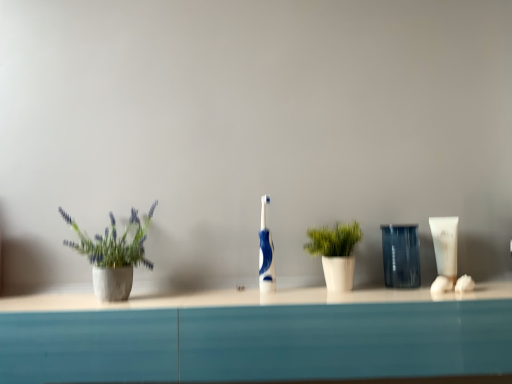
Image resolution: width=512 pixels, height=384 pixels. What are the coordinates of `white matte tube at right` in the screenshot? It's located at (445, 245).

What do you see at coordinates (401, 255) in the screenshot?
I see `transparent plastic cup at center` at bounding box center [401, 255].

How much space does matte concrete pot at left, the 2th houseplant when ordered from right to left, occupy horizontally?

It is 7.01 inches.

The height and width of the screenshot is (384, 512). I want to click on white matte tube at right, so pyautogui.click(x=445, y=245).

Which is more to the left, transparent plastic cup at center or white matte plant pot at center, the second houseplant when ordered from left to right?

Positioned to the left is white matte plant pot at center, the second houseplant when ordered from left to right.

Is transparent plastic cup at center bigger than white matte plant pot at center, which ranks as the first houseplant in right-to-left order?

No, transparent plastic cup at center is not bigger than white matte plant pot at center, which ranks as the first houseplant in right-to-left order.

Considering the sizes of objects transparent plastic cup at center and white matte plant pot at center, the second houseplant when ordered from left to right, in the image provided, who is taller, transparent plastic cup at center or white matte plant pot at center, the second houseplant when ordered from left to right,?

transparent plastic cup at center.

Which object is closer to the camera taking this photo, matte concrete pot at left, the 2th houseplant when ordered from right to left, or white matte tube at right?

Positioned in front is matte concrete pot at left, the 2th houseplant when ordered from right to left.

Is matte concrete pot at left, which is the first houseplant in left-to-right order, to the left of white matte tube at right from the viewer's perspective?

Indeed, matte concrete pot at left, which is the first houseplant in left-to-right order, is positioned on the left side of white matte tube at right.

Is point (98, 285) positioned before point (448, 226)?

That is True.

Looking at the image, does matte concrete pot at left, which is the first houseplant in left-to-right order, seem bigger or smaller compared to white matte tube at right?

matte concrete pot at left, which is the first houseplant in left-to-right order, is bigger than white matte tube at right.

Does white matte plant pot at center, the second houseplant when ordered from left to right, have a greater height compared to matte concrete pot at left, the 2th houseplant when ordered from right to left?

No.

Is point (339, 256) closer to viewer compared to point (135, 246)?

No, it is behind (135, 246).

Is white matte plant pot at center, the second houseplant when ordered from left to right, bigger than matte concrete pot at left, the 2th houseplant when ordered from right to left?

No, white matte plant pot at center, the second houseplant when ordered from left to right, is not bigger than matte concrete pot at left, the 2th houseplant when ordered from right to left.

From the picture: Can matte concrete pot at left, the 2th houseplant when ordered from right to left, be found inside white matte plant pot at center, the second houseplant when ordered from left to right?

No, matte concrete pot at left, the 2th houseplant when ordered from right to left, is not surrounded by white matte plant pot at center, the second houseplant when ordered from left to right.

Consider the image. Would you consider white matte plant pot at center, which ranks as the first houseplant in right-to-left order, to be distant from white matte tube at right?

white matte plant pot at center, which ranks as the first houseplant in right-to-left order, is near white matte tube at right, not far away.

Is white matte plant pot at center, the second houseplant when ordered from left to right, positioned in front of white matte tube at right?

Yes, white matte plant pot at center, the second houseplant when ordered from left to right, is closer to the camera.

Considering the relative sizes of white matte plant pot at center, the second houseplant when ordered from left to right, and white matte tube at right in the image provided, is white matte plant pot at center, the second houseplant when ordered from left to right, shorter than white matte tube at right?

Incorrect, the height of white matte plant pot at center, the second houseplant when ordered from left to right, does not fall short of that of white matte tube at right.

Considering the sizes of objects white matte plant pot at center, the second houseplant when ordered from left to right, and white matte tube at right in the image provided, who is thinner, white matte plant pot at center, the second houseplant when ordered from left to right, or white matte tube at right?

Thinner between the two is white matte tube at right.

Which point is more forward, [101,279] or [347,279]?

The point [101,279] is in front.

Between matte concrete pot at left, which is the first houseplant in left-to-right order, and white matte plant pot at center, the second houseplant when ordered from left to right, which one has smaller size?

With smaller size is white matte plant pot at center, the second houseplant when ordered from left to right.

Looking at this image, is matte concrete pot at left, which is the first houseplant in left-to-right order, not close to white matte plant pot at center, the second houseplant when ordered from left to right?

They are positioned close to each other.

This screenshot has width=512, height=384. Identify the location of toothbrush that appears above the white matte tube at right (from a real-world perspective). (266, 253).

Is blue glossy toothbrush at center shorter than white matte tube at right?

Incorrect, the height of blue glossy toothbrush at center does not fall short of that of white matte tube at right.

Which of these two, blue glossy toothbrush at center or white matte tube at right, is wider?

With larger width is blue glossy toothbrush at center.

What's the angular difference between blue glossy toothbrush at center and white matte tube at right's facing directions?

The angle between the facing direction of blue glossy toothbrush at center and the facing direction of white matte tube at right is 0.29 degrees.

Is white matte plant pot at center, the second houseplant when ordered from left to right, inside or outside of transparent plastic cup at center?

white matte plant pot at center, the second houseplant when ordered from left to right, exists outside the volume of transparent plastic cup at center.

Is white matte plant pot at center, which ranks as the first houseplant in right-to-left order, in front of transparent plastic cup at center?

Yes, it is.

Based on their positions, is white matte plant pot at center, which ranks as the first houseplant in right-to-left order, located to the left or right of transparent plastic cup at center?

white matte plant pot at center, which ranks as the first houseplant in right-to-left order, is to the left of transparent plastic cup at center.

Does point (339, 267) lie behind point (396, 237)?

No.

Where is `houseplant that is the 1st one when counting leftward from the transparent plastic cup at center`? The width and height of the screenshot is (512, 384). houseplant that is the 1st one when counting leftward from the transparent plastic cup at center is located at coordinates (335, 253).

Where is `toiletry that appears below the matte concrete pot at left, the 2th houseplant when ordered from right to left (from a real-world perspective)`? toiletry that appears below the matte concrete pot at left, the 2th houseplant when ordered from right to left (from a real-world perspective) is located at coordinates tap(445, 245).

Which object lies further to the anchor point matte concrete pot at left, the 2th houseplant when ordered from right to left, blue glossy toothbrush at center or transparent plastic cup at center?

transparent plastic cup at center is positioned further to the anchor matte concrete pot at left, the 2th houseplant when ordered from right to left.

Looking at the image, which one is located further to white matte tube at right, transparent plastic cup at center or blue glossy toothbrush at center?

blue glossy toothbrush at center.

Based on their spatial positions, is matte concrete pot at left, which is the first houseplant in left-to-right order, or blue glossy toothbrush at center closer to white matte plant pot at center, which ranks as the first houseplant in right-to-left order?

Based on the image, blue glossy toothbrush at center appears to be nearer to white matte plant pot at center, which ranks as the first houseplant in right-to-left order.

Based on their spatial positions, is white matte tube at right or blue glossy toothbrush at center closer to transparent plastic cup at center?

The object closer to transparent plastic cup at center is white matte tube at right.

Based on their spatial positions, is matte concrete pot at left, which is the first houseplant in left-to-right order, or white matte tube at right closer to white matte plant pot at center, which ranks as the first houseplant in right-to-left order?

white matte tube at right.

Based on their spatial positions, is transparent plastic cup at center or white matte plant pot at center, the second houseplant when ordered from left to right, further from matte concrete pot at left, the 2th houseplant when ordered from right to left?

transparent plastic cup at center is positioned further to the anchor matte concrete pot at left, the 2th houseplant when ordered from right to left.

Looking at this image, estimate the real-world distances between objects in this image. Which object is closer to white matte plant pot at center, the second houseplant when ordered from left to right, white matte tube at right or matte concrete pot at left, the 2th houseplant when ordered from right to left?

The object closer to white matte plant pot at center, the second houseplant when ordered from left to right, is white matte tube at right.

Considering their positions, is white matte plant pot at center, the second houseplant when ordered from left to right, positioned further to white matte tube at right than matte concrete pot at left, which is the first houseplant in left-to-right order?

Based on the image, matte concrete pot at left, which is the first houseplant in left-to-right order, appears to be further to white matte tube at right.

What are the coordinates of `glass vase between white matte plant pot at center, which ranks as the first houseplant in right-to-left order, and white matte tube at right` in the screenshot? It's located at (401, 255).

Where is `houseplant situated between matte concrete pot at left, the 2th houseplant when ordered from right to left, and white matte tube at right from left to right`? houseplant situated between matte concrete pot at left, the 2th houseplant when ordered from right to left, and white matte tube at right from left to right is located at coordinates (335, 253).

The width and height of the screenshot is (512, 384). Find the location of `houseplant situated between blue glossy toothbrush at center and transparent plastic cup at center from left to right`. houseplant situated between blue glossy toothbrush at center and transparent plastic cup at center from left to right is located at coordinates (335, 253).

At what (x,y) coordinates should I click in order to perform the action: click on glass vase between matte concrete pot at left, which is the first houseplant in left-to-right order, and white matte tube at right, in the horizontal direction. Please return your answer as a coordinate pair (x, y). Looking at the image, I should click on (401, 255).